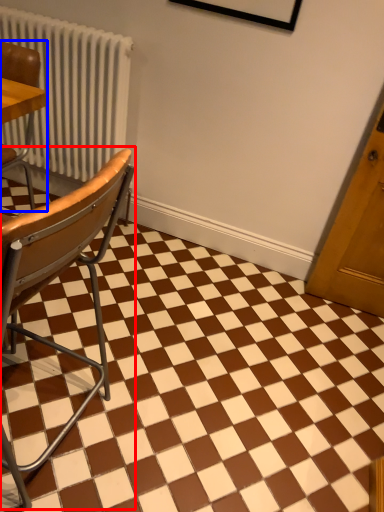
Question: Among these objects, which one is nearest to the camera, chair (highlighted by a red box) or chair (highlighted by a blue box)?

Choices:
 (A) chair
 (B) chair

Answer: (A)